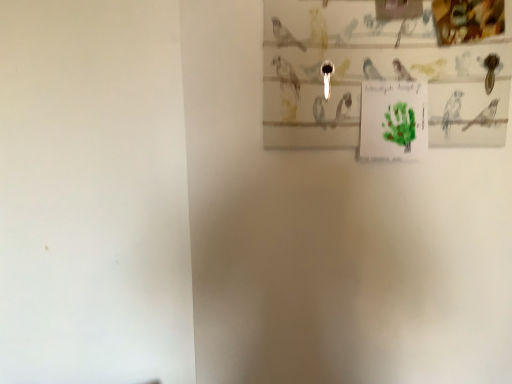
Question: Should I look upward or downward to see matte paper picture frame at upper right?

Choices:
 (A) down
 (B) up

Answer: (B)

Question: Is green paper at upper center at the right side of matte paper picture frame at upper right?

Choices:
 (A) no
 (B) yes

Answer: (B)

Question: Can you confirm if green paper at upper center is positioned to the left of matte paper picture frame at upper right?

Choices:
 (A) no
 (B) yes

Answer: (A)

Question: Does green paper at upper center have a lesser height compared to matte paper picture frame at upper right?

Choices:
 (A) yes
 (B) no

Answer: (A)

Question: Does green paper at upper center turn towards matte paper picture frame at upper right?

Choices:
 (A) no
 (B) yes

Answer: (A)

Question: Is green paper at upper center far away from matte paper picture frame at upper right?

Choices:
 (A) yes
 (B) no

Answer: (B)

Question: Does green paper at upper center come behind matte paper picture frame at upper right?

Choices:
 (A) yes
 (B) no

Answer: (A)

Question: Is matte paper picture frame at upper right positioned in front of green paper at upper center?

Choices:
 (A) yes
 (B) no

Answer: (A)

Question: Does matte paper picture frame at upper right turn towards green paper at upper center?

Choices:
 (A) no
 (B) yes

Answer: (B)

Question: From a real-world perspective, is matte paper picture frame at upper right physically above green paper at upper center?

Choices:
 (A) no
 (B) yes

Answer: (B)

Question: Is matte paper picture frame at upper right to the right of green paper at upper center from the viewer's perspective?

Choices:
 (A) yes
 (B) no

Answer: (B)

Question: Can you confirm if matte paper picture frame at upper right is smaller than green paper at upper center?

Choices:
 (A) no
 (B) yes

Answer: (A)

Question: From the image's perspective, does matte paper picture frame at upper right appear higher than green paper at upper center?

Choices:
 (A) no
 (B) yes

Answer: (B)

Question: Is green paper at upper center in front of or behind matte paper picture frame at upper right in the image?

Choices:
 (A) behind
 (B) front

Answer: (A)